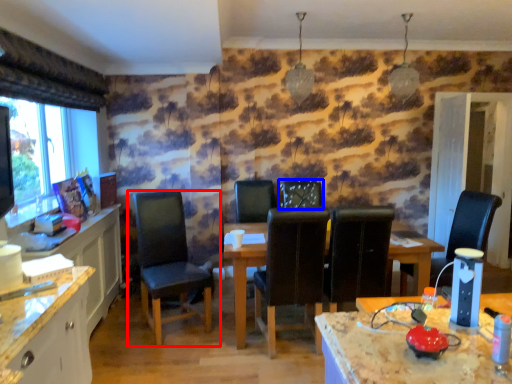
Question: Which point is further to the camera, chair (highlighted by a red box) or chair (highlighted by a blue box)?

Choices:
 (A) chair
 (B) chair

Answer: (B)